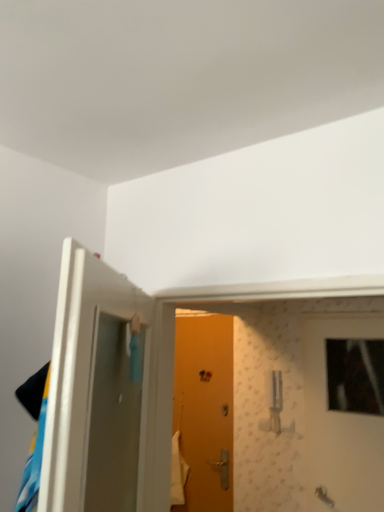
Question: Considering the relative sizes of wooden door at center, arranged as the first door when viewed from the right, and orange matte door at center, the 1th door from the back, in the image provided, is wooden door at center, arranged as the first door when viewed from the right, shorter than orange matte door at center, the 1th door from the back,?

Choices:
 (A) yes
 (B) no

Answer: (A)

Question: From a real-world perspective, is wooden door at center, arranged as the first door when viewed from the right, physically below orange matte door at center, the 1th door from the back?

Choices:
 (A) no
 (B) yes

Answer: (A)

Question: Is wooden door at center, arranged as the first door when viewed from the right, located outside orange matte door at center, arranged as the 2th door when viewed from the right?

Choices:
 (A) no
 (B) yes

Answer: (B)

Question: Are wooden door at center, arranged as the first door when viewed from the right, and orange matte door at center, the 1th door from the back, making contact?

Choices:
 (A) no
 (B) yes

Answer: (A)

Question: Does wooden door at center, which ranks as the third door in left-to-right order, have a smaller size compared to orange matte door at center, which ranks as the 2th door in left-to-right order?

Choices:
 (A) no
 (B) yes

Answer: (B)

Question: From a real-world perspective, is wooden door at center, which is the 2th door from back to front, positioned above or below white glossy door at left, the 3th door in the back-to-front sequence?

Choices:
 (A) below
 (B) above

Answer: (A)

Question: In terms of height, does wooden door at center, arranged as the first door when viewed from the right, look taller or shorter compared to white glossy door at left, which is counted as the 1th door, starting from the front?

Choices:
 (A) tall
 (B) short

Answer: (A)

Question: Considering the positions of point (x=319, y=463) and point (x=69, y=403), is point (x=319, y=463) closer or farther from the camera than point (x=69, y=403)?

Choices:
 (A) farther
 (B) closer

Answer: (A)

Question: Looking at their shapes, would you say wooden door at center, arranged as the first door when viewed from the right, is wider or thinner than white glossy door at left, which is counted as the 1th door, starting from the front?

Choices:
 (A) thin
 (B) wide

Answer: (A)

Question: Visually, is orange matte door at center, which ranks as the 2th door in left-to-right order, positioned to the left or to the right of white glossy door at left, the 3th door in the back-to-front sequence?

Choices:
 (A) right
 (B) left

Answer: (A)

Question: From their relative heights in the image, would you say orange matte door at center, which ranks as the 2th door in left-to-right order, is taller or shorter than white glossy door at left, arranged as the third door when viewed from the right?

Choices:
 (A) tall
 (B) short

Answer: (A)

Question: Is orange matte door at center, the third door from the front, wider or thinner than white glossy door at left, arranged as the third door when viewed from the right?

Choices:
 (A) thin
 (B) wide

Answer: (A)

Question: Is orange matte door at center, the 1th door from the back, inside or outside of white glossy door at left, which is counted as the 1th door, starting from the front?

Choices:
 (A) outside
 (B) inside

Answer: (A)

Question: Based on their positions, is wooden door at center, which ranks as the third door in left-to-right order, located to the left or right of orange matte door at center, which ranks as the 2th door in left-to-right order?

Choices:
 (A) left
 (B) right

Answer: (B)

Question: Relative to orange matte door at center, which ranks as the 2th door in left-to-right order, is wooden door at center, which ranks as the third door in left-to-right order, in front or behind?

Choices:
 (A) front
 (B) behind

Answer: (A)